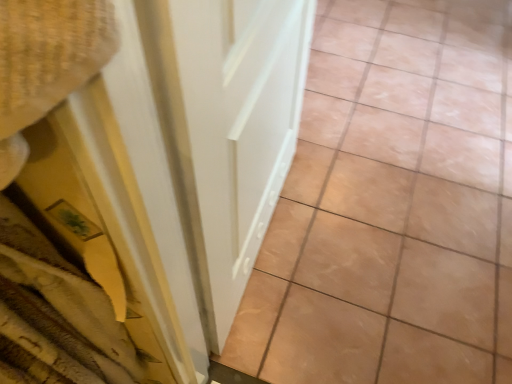
The height and width of the screenshot is (384, 512). What are the coordinates of `empty space that is to the right of white glossy door at center` in the screenshot? It's located at (388, 243).